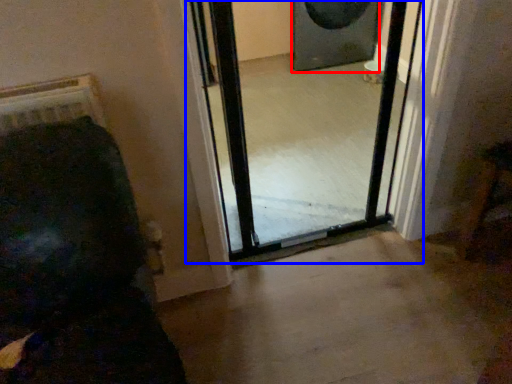
Question: Among these objects, which one is farthest to the camera, speaker (highlighted by a red box) or screen door (highlighted by a blue box)?

Choices:
 (A) speaker
 (B) screen door

Answer: (A)